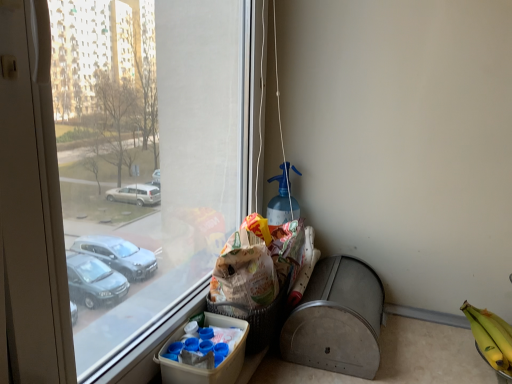
Question: Is metallic gray recycling bin at lower right thinner than yellow matte bananas at lower right?

Choices:
 (A) no
 (B) yes

Answer: (B)

Question: Does metallic gray recycling bin at lower right have a larger size compared to yellow matte bananas at lower right?

Choices:
 (A) yes
 (B) no

Answer: (A)

Question: From a real-world perspective, is metallic gray recycling bin at lower right located beneath yellow matte bananas at lower right?

Choices:
 (A) yes
 (B) no

Answer: (B)

Question: Would you say metallic gray recycling bin at lower right is a long distance from yellow matte bananas at lower right?

Choices:
 (A) yes
 (B) no

Answer: (B)

Question: Does metallic gray recycling bin at lower right appear on the right side of yellow matte bananas at lower right?

Choices:
 (A) no
 (B) yes

Answer: (A)

Question: Is brown paper bag at lower center spatially inside white cardboard box at lower center, or outside of it?

Choices:
 (A) outside
 (B) inside

Answer: (A)

Question: Considering the positions of point (262, 334) and point (156, 357), is point (262, 334) closer or farther from the camera than point (156, 357)?

Choices:
 (A) closer
 (B) farther

Answer: (B)

Question: Is brown paper bag at lower center in front of or behind white cardboard box at lower center in the image?

Choices:
 (A) front
 (B) behind

Answer: (B)

Question: Would you say brown paper bag at lower center is to the left or to the right of white cardboard box at lower center in the picture?

Choices:
 (A) right
 (B) left

Answer: (A)

Question: Would you say metallic gray recycling bin at lower right is to the left or to the right of white cardboard box at lower center in the picture?

Choices:
 (A) left
 (B) right

Answer: (B)

Question: In terms of height, does metallic gray recycling bin at lower right look taller or shorter compared to white cardboard box at lower center?

Choices:
 (A) tall
 (B) short

Answer: (A)

Question: From a real-world perspective, is metallic gray recycling bin at lower right above or below white cardboard box at lower center?

Choices:
 (A) below
 (B) above

Answer: (A)

Question: From the image's perspective, is metallic gray recycling bin at lower right above or below white cardboard box at lower center?

Choices:
 (A) above
 (B) below

Answer: (A)

Question: From the image's perspective, is yellow matte bananas at lower right above or below white paper grocery bag at center?

Choices:
 (A) above
 (B) below

Answer: (B)

Question: Considering their positions, is yellow matte bananas at lower right located in front of or behind white paper grocery bag at center?

Choices:
 (A) front
 (B) behind

Answer: (A)